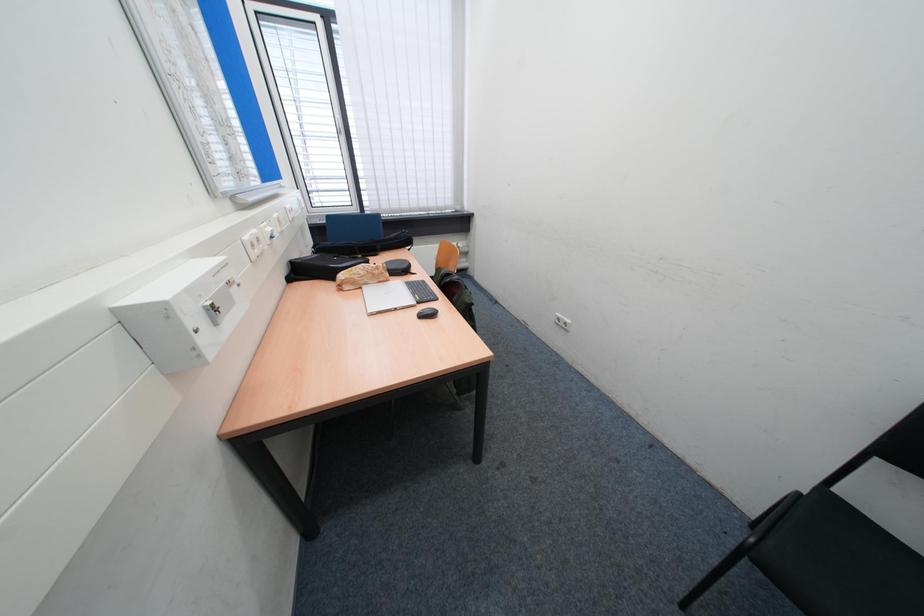
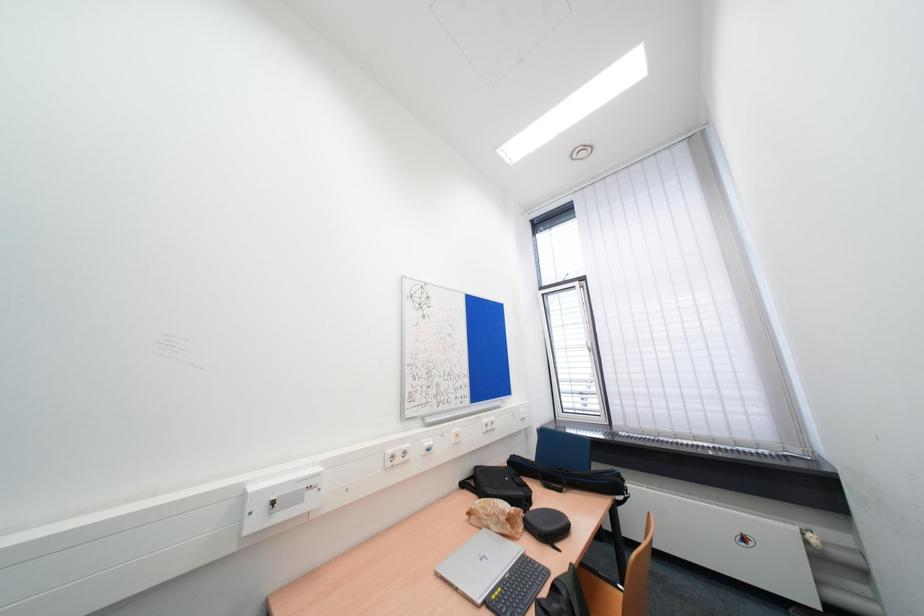
Based on the continuous images, in which direction is the camera rotating?

The camera's rotation is toward left-up.